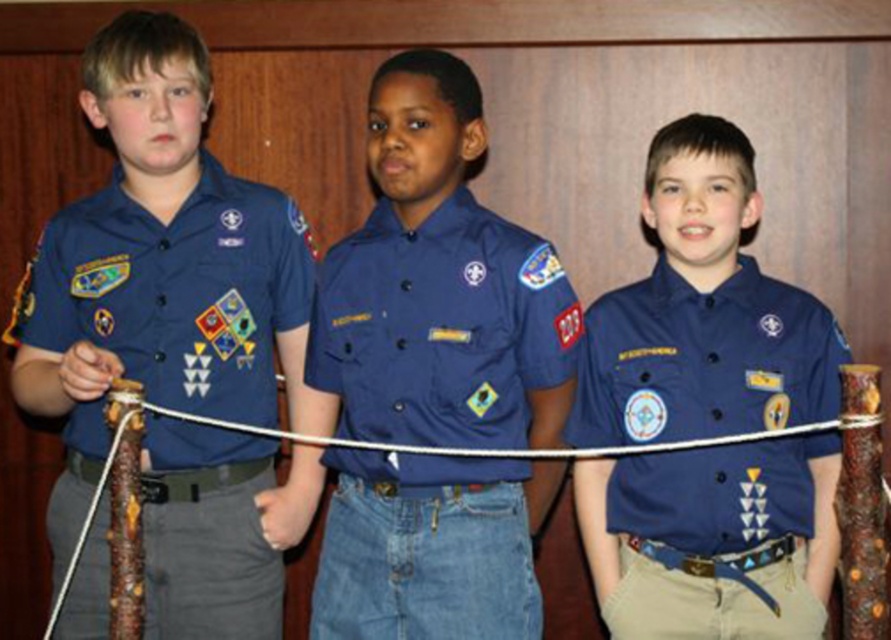
You are a photographer trying to capture the three boys in their uniforms. You notice a point marked at coordinates (440, 326) in the image. Which boy is wearing the blue cotton shirt located exactly at that point?

The point at coordinates (440, 326) marks the blue cotton shirt at center, so the middle boy is wearing the blue cotton shirt located exactly at that point.

You are a photographer trying to capture a photo of the three boys. You notice two points marked in the image. Which point is closer to you, point (379,483) or point (681,481)?

Point (379,483) is closer to the viewer than point (681,481).